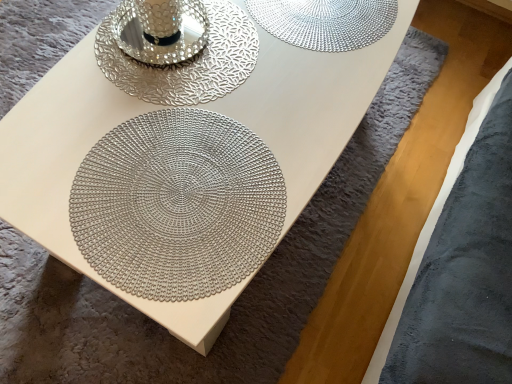
Question: Do you think metallic silver mandala at center is within silver textured candle holder at upper center, or outside of it?

Choices:
 (A) outside
 (B) inside

Answer: (A)

Question: Visually, is metallic silver mandala at center positioned to the left or to the right of silver textured candle holder at upper center?

Choices:
 (A) left
 (B) right

Answer: (B)

Question: From a real-world perspective, relative to silver textured candle holder at upper center, is metallic silver mandala at center vertically above or below?

Choices:
 (A) above
 (B) below

Answer: (B)

Question: Is silver textured candle holder at upper center inside the boundaries of metallic silver mandala at center, or outside?

Choices:
 (A) outside
 (B) inside

Answer: (A)

Question: Visually, is silver textured candle holder at upper center positioned to the left or to the right of metallic silver mandala at center?

Choices:
 (A) left
 (B) right

Answer: (A)

Question: From a real-world perspective, is silver textured candle holder at upper center positioned above or below metallic silver mandala at center?

Choices:
 (A) below
 (B) above

Answer: (B)

Question: Considering the positions of point (145, 79) and point (111, 235), is point (145, 79) closer or farther from the camera than point (111, 235)?

Choices:
 (A) farther
 (B) closer

Answer: (A)